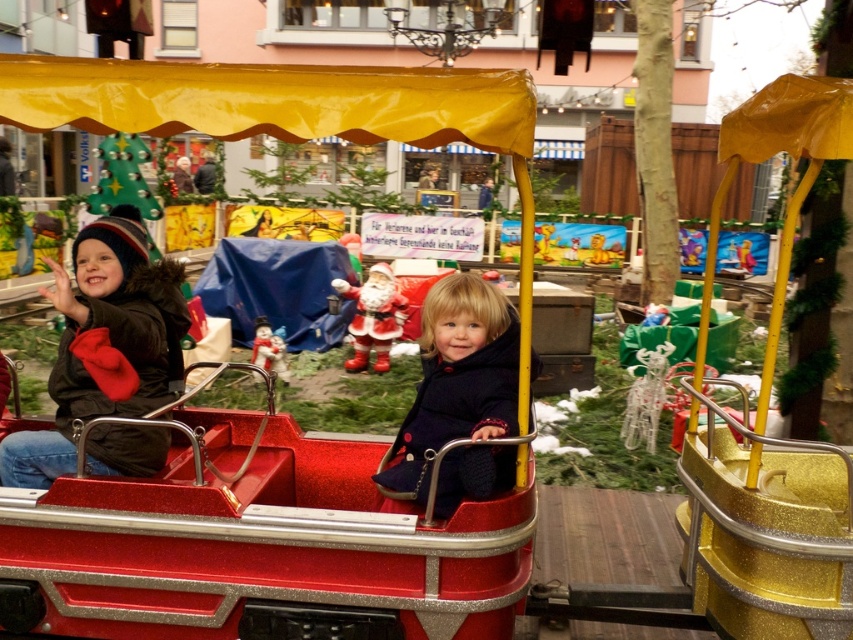
You are standing at the entrance of the Christmas market and see the shiny red wagon at center. If you want to reach it as quickly as possible, which direction should you walk towards?

Since the shiny red wagon at center is located at the center of the image, you should walk straight ahead towards the center of the market to reach it quickly.

You are standing in front of the Christmas market rides and want to take a photo of both the point at coordinates (115, 250) and the point at (451, 328). Which point should you focus on first to ensure both are in the frame?

You should focus on the point at coordinates (115, 250) first because it is closer to you than the point at (451, 328), ensuring both points are within the camera frame.

You are standing at the entrance of the Christmas market and want to take a photo of the point located at coordinates point (457, 592). The camera you have can focus on objects within 10 feet. Will the point be in focus?

The distance of point (457, 592) from viewer is 9.63 feet, which is within the camera focus range of 10 feet. Therefore, the point will be in focus.